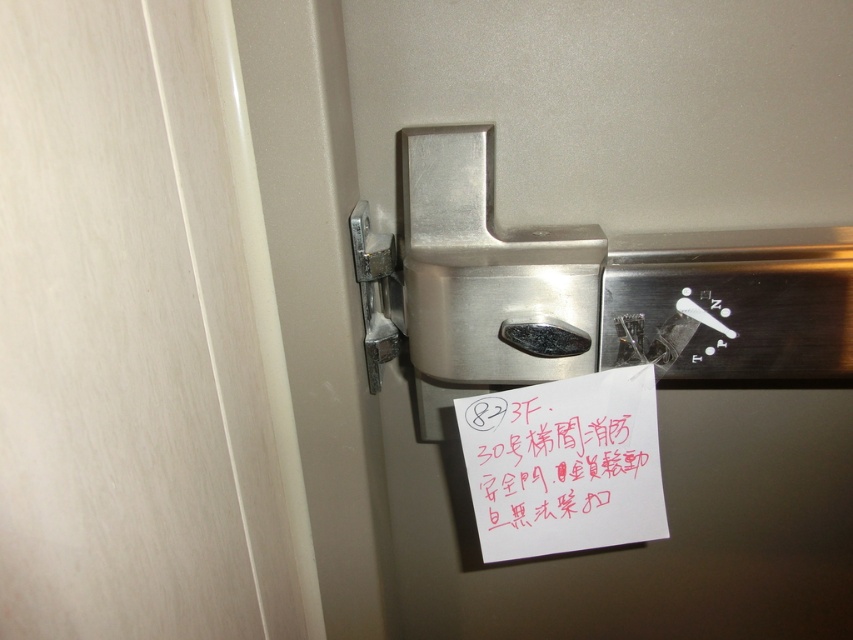
Does satin silver lock at center appear on the right side of satin silver hinge at upper right?

Indeed, satin silver lock at center is positioned on the right side of satin silver hinge at upper right.

Is satin silver lock at center thinner than satin silver hinge at upper right?

No.

What do you see at coordinates (555, 221) in the screenshot? This screenshot has width=853, height=640. I see `satin silver lock at center` at bounding box center [555, 221].

Locate an element on the screen. satin silver lock at center is located at coordinates point(555,221).

Who is more distant from viewer, (723, 156) or (502, 552)?

The point (502, 552) is more distant.

Can you confirm if satin silver lock at center is wider than white paper at center?

Yes.

Image resolution: width=853 pixels, height=640 pixels. What are the coordinates of `satin silver lock at center` in the screenshot? It's located at click(555, 221).

Who is shorter, white paper at center or satin silver hinge at upper right?

white paper at center is shorter.

Find the location of `white paper at center`. white paper at center is located at coordinates (563, 467).